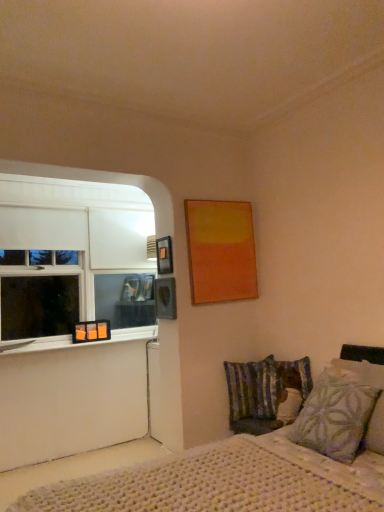
Question: Considering the positions of clear glass window sill at lower left and white matte window at left in the image, is clear glass window sill at lower left wider or thinner than white matte window at left?

Choices:
 (A) wide
 (B) thin

Answer: (A)

Question: Considering the positions of clear glass window sill at lower left and white matte window at left in the image, is clear glass window sill at lower left bigger or smaller than white matte window at left?

Choices:
 (A) small
 (B) big

Answer: (A)

Question: Which of these objects is positioned farthest from the white matte window at left?

Choices:
 (A) orange matte picture frame at window, the 3th picture frame positioned from the front
 (B) patterned fabric pillow at lower right, marked as the 2th pillow in a back-to-front arrangement
 (C) matte orange painting at upper right, which is the first picture frame from top to bottom
 (D) white knitted bed at lower right
 (E) striped fabric pillow at lower right, which appears as the second pillow when viewed from the right

Answer: (B)

Question: Which of these objects is positioned farthest from the matte orange painting at upper right, the 1th picture frame in the right-to-left sequence?

Choices:
 (A) orange matte picture frame at window, the first picture frame in the bottom-to-top sequence
 (B) patterned fabric pillow at lower right, marked as the first pillow in a right-to-left arrangement
 (C) white matte window at left
 (D) striped fabric pillow at lower right, which is counted as the 2th pillow, starting from the front
 (E) matte black picture frame at upper left, acting as the 2th picture frame starting from the front

Answer: (A)